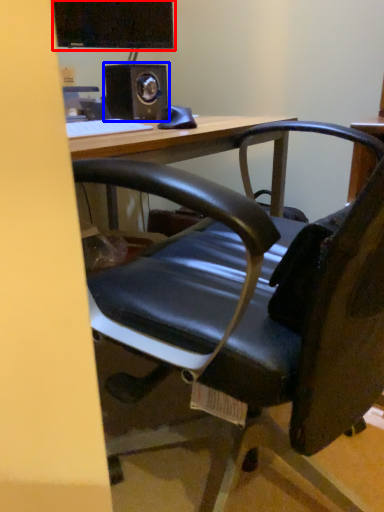
Question: Which point is further to the camera, computer monitor (highlighted by a red box) or speaker (highlighted by a blue box)?

Choices:
 (A) computer monitor
 (B) speaker

Answer: (A)